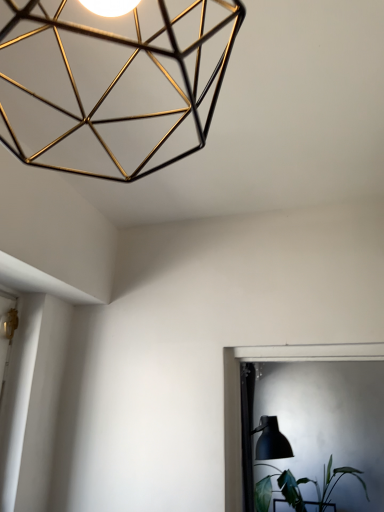
Question: Is gold wireframe lamp at upper left positioned in front of matte black table lamp at lower right?

Choices:
 (A) yes
 (B) no

Answer: (A)

Question: Considering the relative sizes of gold wireframe lamp at upper left and matte black table lamp at lower right in the image provided, is gold wireframe lamp at upper left thinner than matte black table lamp at lower right?

Choices:
 (A) no
 (B) yes

Answer: (B)

Question: From the image's perspective, is gold wireframe lamp at upper left on top of matte black table lamp at lower right?

Choices:
 (A) no
 (B) yes

Answer: (B)

Question: From a real-world perspective, does gold wireframe lamp at upper left stand above matte black table lamp at lower right?

Choices:
 (A) yes
 (B) no

Answer: (A)

Question: Is gold wireframe lamp at upper left taller than matte black table lamp at lower right?

Choices:
 (A) yes
 (B) no

Answer: (B)

Question: Are gold wireframe lamp at upper left and matte black table lamp at lower right beside each other?

Choices:
 (A) no
 (B) yes

Answer: (A)

Question: Is matte black table lamp at lower right completely or partially outside of gold wireframe lamp at upper left?

Choices:
 (A) yes
 (B) no

Answer: (A)

Question: From the image's perspective, is matte black table lamp at lower right under gold wireframe lamp at upper left?

Choices:
 (A) no
 (B) yes

Answer: (B)

Question: From a real-world perspective, does matte black table lamp at lower right stand above gold wireframe lamp at upper left?

Choices:
 (A) no
 (B) yes

Answer: (A)

Question: Would you say matte black table lamp at lower right contains gold wireframe lamp at upper left?

Choices:
 (A) yes
 (B) no

Answer: (B)

Question: From the image's perspective, is matte black table lamp at lower right on gold wireframe lamp at upper left?

Choices:
 (A) no
 (B) yes

Answer: (A)

Question: Is matte black table lamp at lower right looking in the opposite direction of gold wireframe lamp at upper left?

Choices:
 (A) no
 (B) yes

Answer: (A)

Question: Is green leafy plant at lower right beside matte black table lamp at lower right?

Choices:
 (A) no
 (B) yes

Answer: (A)